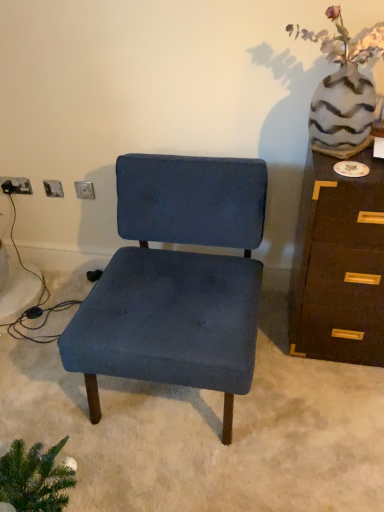
In order to face speckled ceramic vase at upper right, should I rotate leftwards or rightwards?

Rotate right and turn 19.480 degrees.

This screenshot has width=384, height=512. Describe the element at coordinates (339, 265) in the screenshot. I see `brown wood chest of drawers at right` at that location.

Where is `matte silver outlet at lower left, acting as the 2th electric outlet starting from the front`? matte silver outlet at lower left, acting as the 2th electric outlet starting from the front is located at coordinates (16, 185).

Image resolution: width=384 pixels, height=512 pixels. What do you see at coordinates (16, 185) in the screenshot?
I see `matte silver outlet at lower left, which is counted as the first electric outlet, starting from the back` at bounding box center [16, 185].

Identify the location of speckled ceramic vase at upper right. The height and width of the screenshot is (512, 384). (343, 90).

Does velvet blue chair at center turn towards matte silver outlet at lower left, acting as the 2th electric outlet starting from the front?

No, velvet blue chair at center is not aimed at matte silver outlet at lower left, acting as the 2th electric outlet starting from the front.

Is velvet blue chair at center next to matte silver outlet at lower left, acting as the 2th electric outlet starting from the front, and touching it?

No, velvet blue chair at center is not next to matte silver outlet at lower left, acting as the 2th electric outlet starting from the front.

Which object is further away from the camera taking this photo, velvet blue chair at center or matte silver outlet at lower left, which is counted as the first electric outlet, starting from the back?

matte silver outlet at lower left, which is counted as the first electric outlet, starting from the back, is further from the camera.

Locate an element on the screen. chair in front of the matte silver outlet at lower left, arranged as the 1th electric outlet when viewed from the left is located at coordinates click(x=176, y=281).

Does velvet blue chair at center have a greater height compared to metallic silver electric outlet at upper left, the 1th electric outlet when ordered from front to back?

Indeed, velvet blue chair at center has a greater height compared to metallic silver electric outlet at upper left, the 1th electric outlet when ordered from front to back.

Is velvet blue chair at center placed right next to metallic silver electric outlet at upper left, the 1th electric outlet when ordered from front to back?

velvet blue chair at center is not next to metallic silver electric outlet at upper left, the 1th electric outlet when ordered from front to back, and they're not touching.

Do you think velvet blue chair at center is within metallic silver electric outlet at upper left, which is counted as the 2th electric outlet, starting from the back, or outside of it?

velvet blue chair at center is located beyond the bounds of metallic silver electric outlet at upper left, which is counted as the 2th electric outlet, starting from the back.

Considering the relative positions of matte silver outlet at lower left, the second electric outlet viewed from the right, and brown wood chest of drawers at right in the image provided, is matte silver outlet at lower left, the second electric outlet viewed from the right, to the left of brown wood chest of drawers at right from the viewer's perspective?

Yes, matte silver outlet at lower left, the second electric outlet viewed from the right, is to the left of brown wood chest of drawers at right.

Where is `electric outlet that is the 2nd one when counting backward from the brown wood chest of drawers at right`? electric outlet that is the 2nd one when counting backward from the brown wood chest of drawers at right is located at coordinates (16, 185).

Is matte silver outlet at lower left, arranged as the 1th electric outlet when viewed from the left, aimed at brown wood chest of drawers at right?

No, matte silver outlet at lower left, arranged as the 1th electric outlet when viewed from the left, is not facing towards brown wood chest of drawers at right.

From a real-world perspective, is matte silver outlet at lower left, acting as the 2th electric outlet starting from the front, above or below brown wood chest of drawers at right?

Clearly, from a real-world perspective, matte silver outlet at lower left, acting as the 2th electric outlet starting from the front, is above brown wood chest of drawers at right.

Based on the photo, considering the relative sizes of brown wood chest of drawers at right and matte silver outlet at lower left, which is counted as the first electric outlet, starting from the back, in the image provided, is brown wood chest of drawers at right smaller than matte silver outlet at lower left, which is counted as the first electric outlet, starting from the back,?

Actually, brown wood chest of drawers at right might be larger than matte silver outlet at lower left, which is counted as the first electric outlet, starting from the back.

How much distance is there between brown wood chest of drawers at right and matte silver outlet at lower left, arranged as the 1th electric outlet when viewed from the left?

The distance of brown wood chest of drawers at right from matte silver outlet at lower left, arranged as the 1th electric outlet when viewed from the left, is 4.66 feet.

Does point (300, 239) appear closer or farther from the camera than point (6, 183)?

Point (300, 239).

Is brown wood chest of drawers at right placed right next to matte silver outlet at lower left, acting as the 2th electric outlet starting from the front?

They are not placed beside each other.

Which is more distant, [4,191] or [323,122]?

The point [4,191] is farther.

This screenshot has height=512, width=384. I want to click on floral arrangement on the right of the matte silver outlet at lower left, which is counted as the first electric outlet, starting from the back, so click(x=343, y=90).

Based on the photo, measure the distance from matte silver outlet at lower left, the second electric outlet viewed from the right, to speckled ceramic vase at upper right.

matte silver outlet at lower left, the second electric outlet viewed from the right, and speckled ceramic vase at upper right are 4.55 feet apart from each other.

Is matte silver outlet at lower left, which is counted as the first electric outlet, starting from the back, located outside speckled ceramic vase at upper right?

matte silver outlet at lower left, which is counted as the first electric outlet, starting from the back, is positioned outside speckled ceramic vase at upper right.

From a real-world perspective, is brown wood chest of drawers at right positioned above or below speckled ceramic vase at upper right?

brown wood chest of drawers at right is below speckled ceramic vase at upper right.

Is brown wood chest of drawers at right facing towards speckled ceramic vase at upper right?

No, brown wood chest of drawers at right is not oriented towards speckled ceramic vase at upper right.

Is the position of brown wood chest of drawers at right more distant than that of speckled ceramic vase at upper right?

Yes, brown wood chest of drawers at right is further from the viewer.

Does point (364, 249) come closer to viewer compared to point (301, 29)?

Yes, point (364, 249) is in front of point (301, 29).

Which is behind, speckled ceramic vase at upper right or matte silver outlet at lower left, arranged as the 1th electric outlet when viewed from the left?

Positioned behind is matte silver outlet at lower left, arranged as the 1th electric outlet when viewed from the left.

Is speckled ceramic vase at upper right turned away from matte silver outlet at lower left, acting as the 2th electric outlet starting from the front?

No, speckled ceramic vase at upper right's orientation is not away from matte silver outlet at lower left, acting as the 2th electric outlet starting from the front.

Looking at this image, does speckled ceramic vase at upper right have a greater width compared to matte silver outlet at lower left, the second electric outlet viewed from the right?

Correct, the width of speckled ceramic vase at upper right exceeds that of matte silver outlet at lower left, the second electric outlet viewed from the right.

Would you say speckled ceramic vase at upper right is outside matte silver outlet at lower left, which is counted as the first electric outlet, starting from the back?

That's correct, speckled ceramic vase at upper right is outside of matte silver outlet at lower left, which is counted as the first electric outlet, starting from the back.

Find the location of a particular element. This screenshot has width=384, height=512. the 2nd electric outlet behind the velvet blue chair at center is located at coordinates (16, 185).

In order to click on electric outlet that is the 1st object located above the velvet blue chair at center (from the image's perspective) in this screenshot , I will do `click(85, 190)`.

Considering their positions, is matte silver outlet at lower left, which is counted as the first electric outlet, starting from the back, positioned further to speckled ceramic vase at upper right than metallic silver electric outlet at upper left, which is counted as the 2th electric outlet, starting from the back?

matte silver outlet at lower left, which is counted as the first electric outlet, starting from the back.

Which object lies further to the anchor point speckled ceramic vase at upper right, matte silver outlet at lower left, which is counted as the first electric outlet, starting from the back, or velvet blue chair at center?

matte silver outlet at lower left, which is counted as the first electric outlet, starting from the back, is further to speckled ceramic vase at upper right.

From the image, which object appears to be nearer to velvet blue chair at center, metallic silver electric outlet at upper left, marked as the 1th electric outlet in a right-to-left arrangement, or brown wood chest of drawers at right?

Based on the image, brown wood chest of drawers at right appears to be nearer to velvet blue chair at center.

Based on the photo, considering their positions, is metallic silver electric outlet at upper left, which is the second electric outlet from left to right, positioned further to matte silver outlet at lower left, which is counted as the first electric outlet, starting from the back, than velvet blue chair at center?

velvet blue chair at center.

Looking at the image, which one is located closer to velvet blue chair at center, matte silver outlet at lower left, the second electric outlet viewed from the right, or brown wood chest of drawers at right?

brown wood chest of drawers at right is positioned closer to the anchor velvet blue chair at center.

Looking at the image, which one is located closer to speckled ceramic vase at upper right, brown wood chest of drawers at right or velvet blue chair at center?

brown wood chest of drawers at right is closer to speckled ceramic vase at upper right.

Looking at the image, which one is located closer to metallic silver electric outlet at upper left, marked as the 1th electric outlet in a right-to-left arrangement, speckled ceramic vase at upper right or velvet blue chair at center?

velvet blue chair at center lies closer to metallic silver electric outlet at upper left, marked as the 1th electric outlet in a right-to-left arrangement, than the other object.

When comparing their distances from brown wood chest of drawers at right, does matte silver outlet at lower left, arranged as the 1th electric outlet when viewed from the left, or velvet blue chair at center seem closer?

Among the two, velvet blue chair at center is located nearer to brown wood chest of drawers at right.

What are the coordinates of `floral arrangement positioned between velvet blue chair at center and metallic silver electric outlet at upper left, marked as the 1th electric outlet in a right-to-left arrangement, from near to far` in the screenshot? It's located at (343, 90).

Find the location of a particular element. floral arrangement between metallic silver electric outlet at upper left, which is the second electric outlet from left to right, and brown wood chest of drawers at right is located at coordinates (343, 90).

This screenshot has height=512, width=384. Identify the location of chair between matte silver outlet at lower left, arranged as the 1th electric outlet when viewed from the left, and speckled ceramic vase at upper right, in the horizontal direction. (176, 281).

The height and width of the screenshot is (512, 384). Identify the location of chair located between matte silver outlet at lower left, acting as the 2th electric outlet starting from the front, and brown wood chest of drawers at right in the left-right direction. (176, 281).